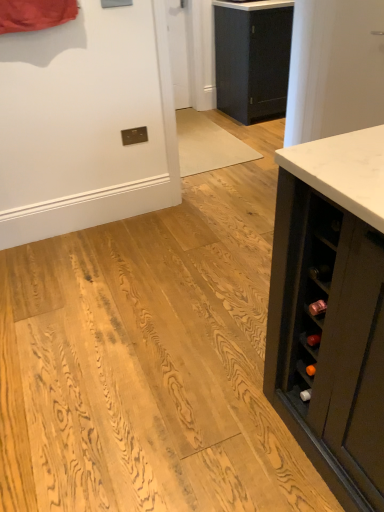
Question: From the image's perspective, would you say matte black cabinet at center is positioned over white marble countertop at upper center?

Choices:
 (A) yes
 (B) no

Answer: (B)

Question: Is matte black cabinet at center further to the viewer compared to white marble countertop at upper center?

Choices:
 (A) yes
 (B) no

Answer: (A)

Question: From the image's perspective, is matte black cabinet at center located beneath white marble countertop at upper center?

Choices:
 (A) no
 (B) yes

Answer: (B)

Question: Can you confirm if matte black cabinet at center is wider than white marble countertop at upper center?

Choices:
 (A) yes
 (B) no

Answer: (B)

Question: Can you see matte black cabinet at center touching white marble countertop at upper center?

Choices:
 (A) no
 (B) yes

Answer: (A)

Question: Does matte black cabinet at center turn towards white marble countertop at upper center?

Choices:
 (A) yes
 (B) no

Answer: (B)

Question: Would you say white marble countertop at upper center is outside matte black cabinet at center?

Choices:
 (A) no
 (B) yes

Answer: (B)

Question: Is white marble countertop at upper center at the right side of matte black cabinet at center?

Choices:
 (A) no
 (B) yes

Answer: (A)

Question: Considering the relative positions of white marble countertop at upper center and matte black cabinet at center in the image provided, is white marble countertop at upper center in front of matte black cabinet at center?

Choices:
 (A) yes
 (B) no

Answer: (A)

Question: From a real-world perspective, is white marble countertop at upper center on top of matte black cabinet at center?

Choices:
 (A) yes
 (B) no

Answer: (A)

Question: From the image's perspective, does white marble countertop at upper center appear higher than matte black cabinet at center?

Choices:
 (A) yes
 (B) no

Answer: (A)

Question: Is white marble countertop at upper center beside matte black cabinet at center?

Choices:
 (A) yes
 (B) no

Answer: (B)

Question: From a real-world perspective, is matte black cabinet at center positioned above or below white marble countertop at upper center?

Choices:
 (A) below
 (B) above

Answer: (A)